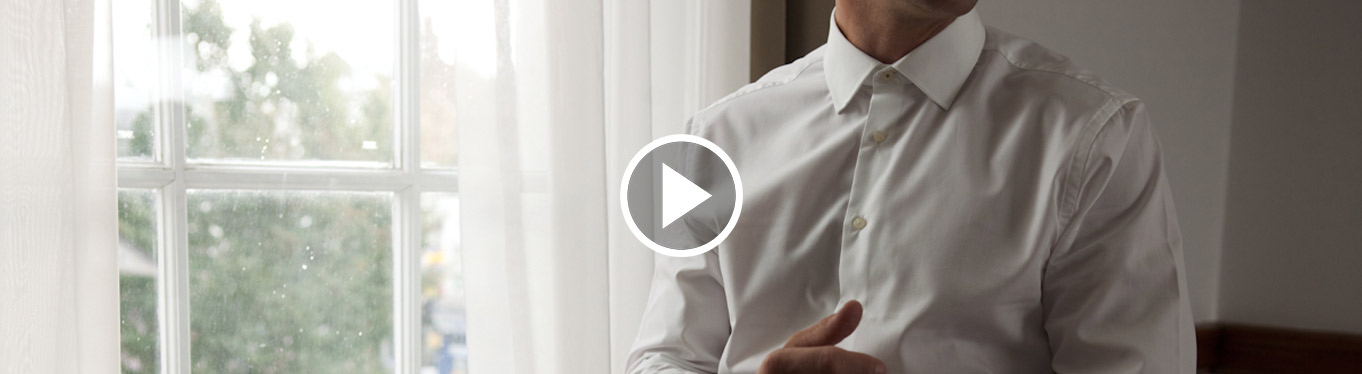
Identify the location of window. (275, 262).